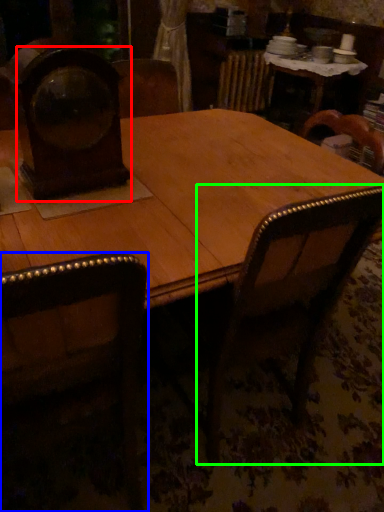
Question: Estimate the real-world distances between objects in this image. Which object is farther from clock (highlighted by a red box), chair (highlighted by a blue box) or armchair (highlighted by a green box)?

Choices:
 (A) chair
 (B) armchair

Answer: (B)